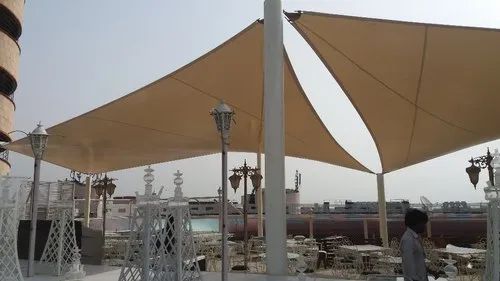
I want to click on dining chairs, so click(257, 258), click(219, 255), click(349, 264), click(376, 267), click(446, 270).